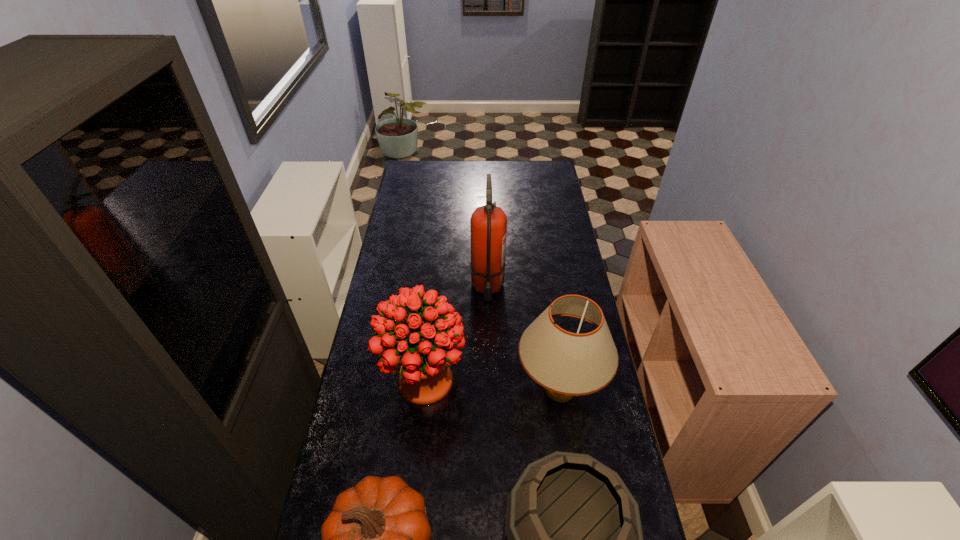
Locate an element on the screen. vacant space at the right edge is located at coordinates (595, 400).

Identify the location of vacant area at the far right corner. This screenshot has width=960, height=540. (538, 181).

This screenshot has width=960, height=540. I want to click on object that is the second nearest to the farthest object, so click(566, 364).

Select which object is the closest to the wine bucket. Please provide its 2D coordinates. Your answer should be formatted as a tuple, i.e. [(x, y)], where the tuple contains the x and y coordinates of a point satisfying the conditions above.

[(376, 539)]

Where is `free space that satisfies the following two spatial constraints: 1. on the nozzle of the lampshade; 2. on the left side of the fire extinguisher`? Image resolution: width=960 pixels, height=540 pixels. free space that satisfies the following two spatial constraints: 1. on the nozzle of the lampshade; 2. on the left side of the fire extinguisher is located at coordinates (490, 389).

Locate an element on the screen. free space that satisfies the following two spatial constraints: 1. on the nozzle of the lampshade; 2. on the right side of the fire extinguisher is located at coordinates (490, 389).